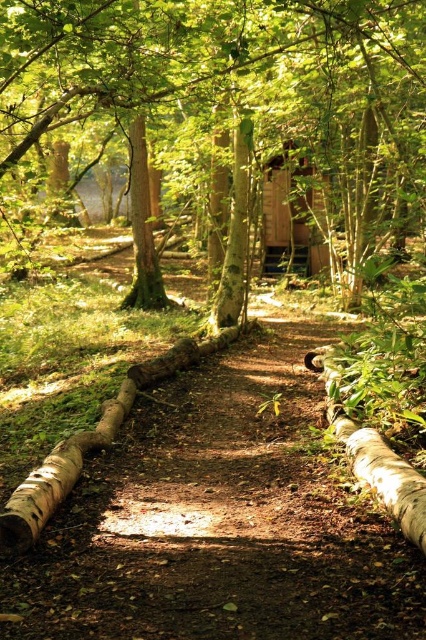
You are standing at the entrance of the forest and see the brown dirt path at center and the smooth brown tree trunk at center. Which object is nearer to you?

The brown dirt path at center is closer to the viewer than the smooth brown tree trunk at center, so the brown dirt path at center is nearer to you.

You are planning to walk along the brown dirt path at center towards the wooden cabin at center. Considering the path width, will you have enough space to walk comfortably without stepping off the path?

The brown dirt path at center has a lesser width compared to wooden cabin at center, so the path may be narrow, but since the cabin is wider, it might not directly affect the path width. However, based on the description, the path is narrower than the cabin, so you might need to walk carefully to stay on it.